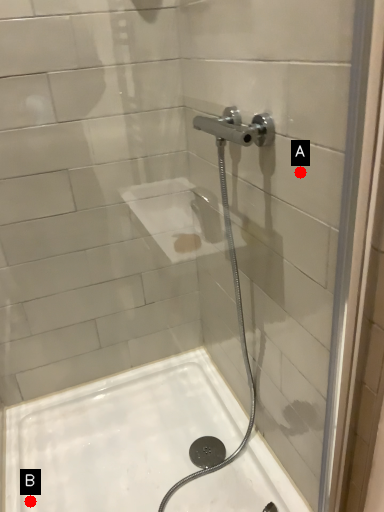
Question: Two points are circled on the image, labeled by A and B beside each circle. Which of the following is the closest to the observer?

Choices:
 (A) A is closer
 (B) B is closer

Answer: (A)